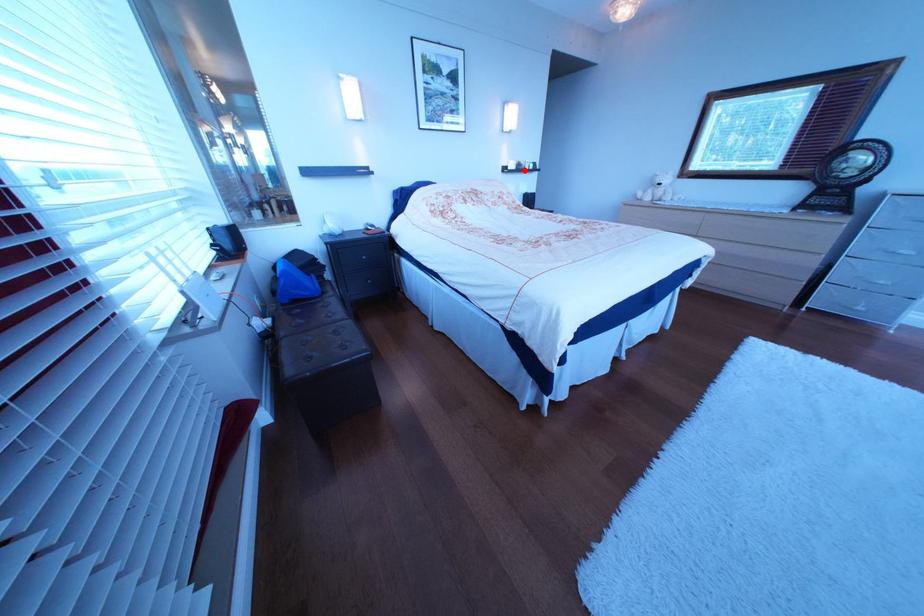
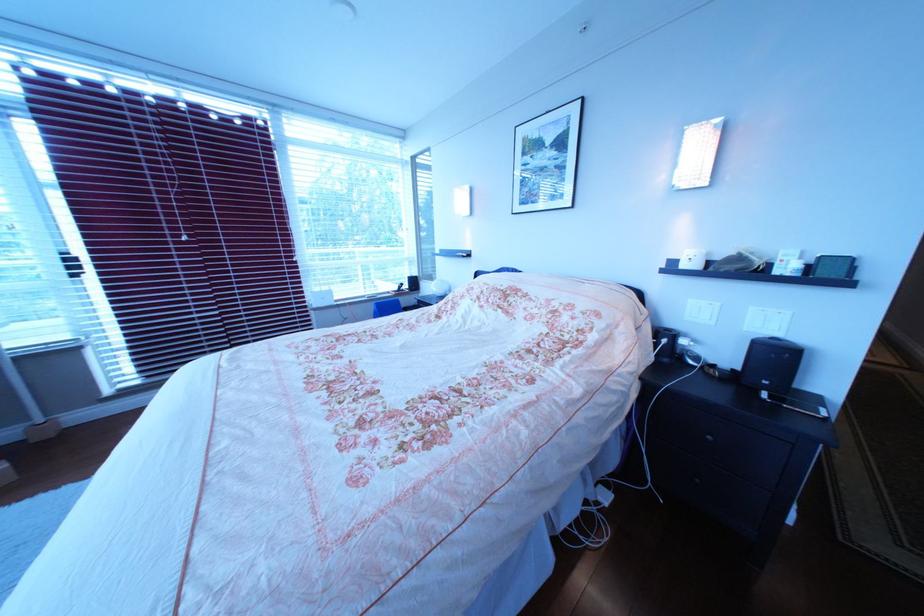
Find the pixel in the second image that matches the highlighted location in the first image.

(699, 267)